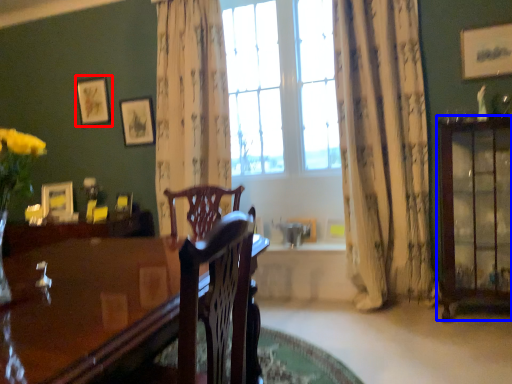
Question: Which object appears farthest to the camera in this image, picture frame (highlighted by a red box) or cabinetry (highlighted by a blue box)?

Choices:
 (A) picture frame
 (B) cabinetry

Answer: (A)